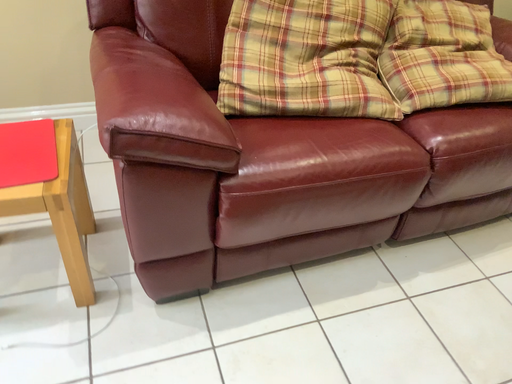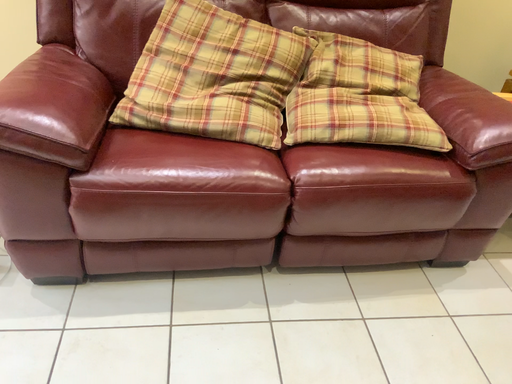
Question: How did the camera likely rotate when shooting the video?

Choices:
 (A) rotated right
 (B) rotated left

Answer: (B)